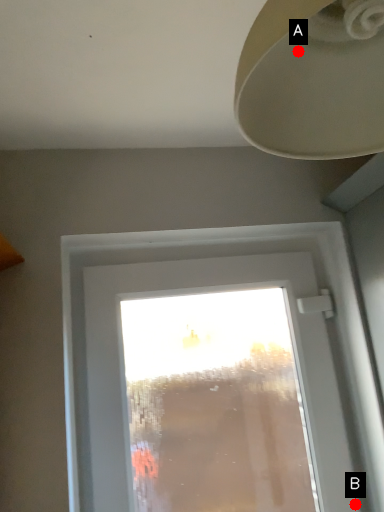
Question: Two points are circled on the image, labeled by A and B beside each circle. Which of the following is the closest to the observer?

Choices:
 (A) A is closer
 (B) B is closer

Answer: (A)